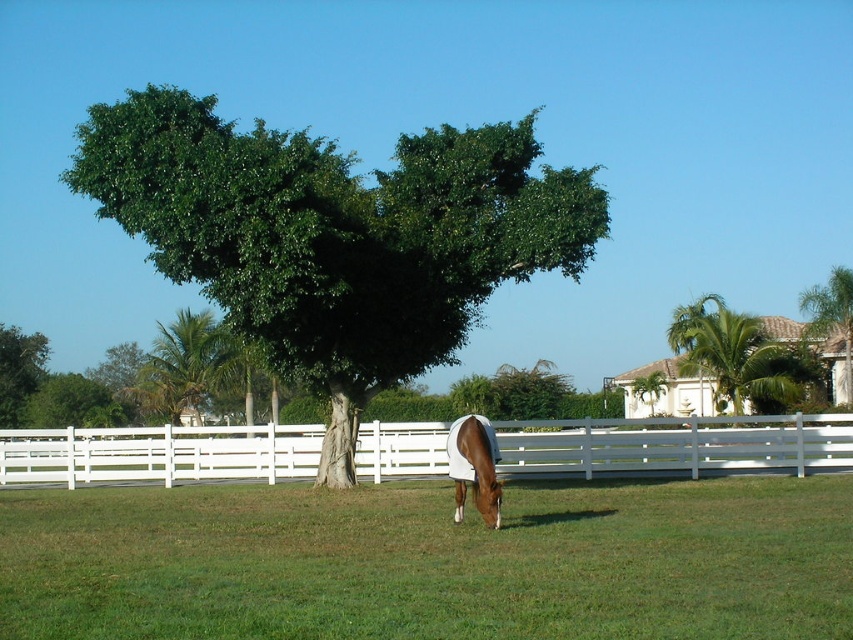
Is white wooden fence at center positioned in front of brown glossy horse at center?

No, it is not.

Can you confirm if white wooden fence at center is thinner than brown glossy horse at center?

No.

At what (x,y) coordinates should I click in order to perform the action: click on white wooden fence at center. Please return your answer as a coordinate pair (x, y). The image size is (853, 640). Looking at the image, I should click on (675, 444).

Is green leafy tree at center further to camera compared to green leafy tree at left?

No, green leafy tree at center is in front of green leafy tree at left.

Looking at this image, does green leafy tree at center have a smaller size compared to green leafy tree at left?

Actually, green leafy tree at center might be larger than green leafy tree at left.

Is point (445, 154) behind point (41, 374)?

No, it is not.

Where is `green leafy tree at center`? The height and width of the screenshot is (640, 853). green leafy tree at center is located at coordinates (335, 236).

You are a GUI agent. You are given a task and a screenshot of the screen. Output one action in this format:
    pyautogui.click(x=<x>, y=<y>)
    Task: Click on the green leafy tree at center
    This screenshot has height=640, width=853.
    Given the screenshot: What is the action you would take?
    pyautogui.click(x=335, y=236)

Is point (297, 349) positioned before point (196, 403)?

That is True.

Does point (482, 161) come in front of point (169, 374)?

That is True.

The height and width of the screenshot is (640, 853). I want to click on green leafy tree at center, so click(335, 236).